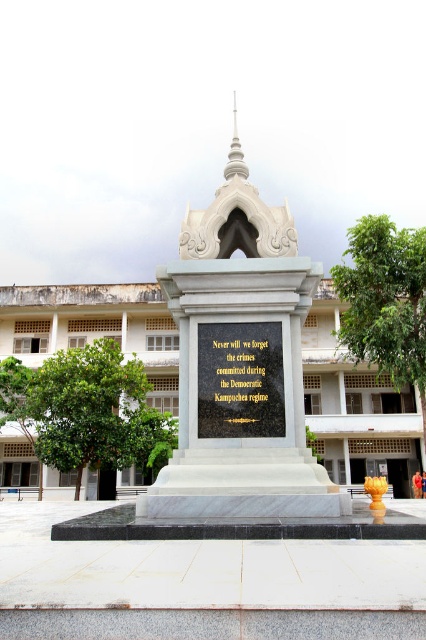
Is point (232, 358) closer to viewer compared to point (199, 324)?

Yes.

Which is behind, point (222, 236) or point (210, 346)?

The point (222, 236) is more distant.

Between point (233, 237) and point (219, 385), which one is positioned in front?

Point (219, 385)

The width and height of the screenshot is (426, 640). In order to click on white marble monument at center in this screenshot , I will do `click(241, 364)`.